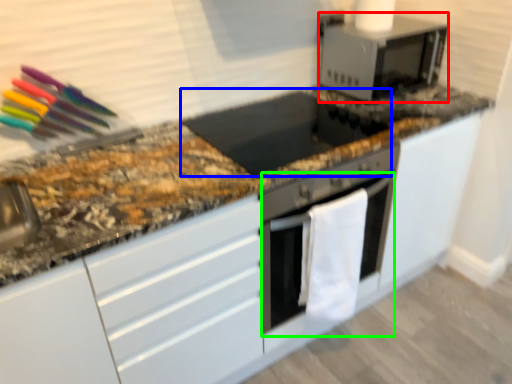
Question: Which is farther away from microwave oven (highlighted by a red box)? appliance (highlighted by a blue box) or oven (highlighted by a green box)?

Choices:
 (A) appliance
 (B) oven

Answer: (B)